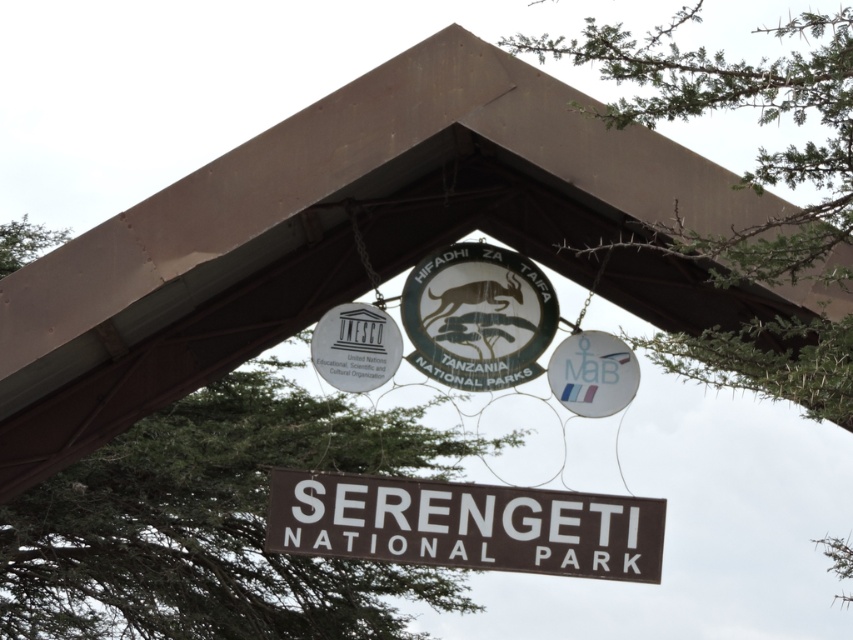
Is green leafy tree at center smaller than brown matte signboard at center?

Actually, green leafy tree at center might be larger than brown matte signboard at center.

Between green leafy tree at center and brown matte signboard at center, which one appears on the right side from the viewer's perspective?

brown matte signboard at center

Measure the distance between point (462, 593) and camera.

Point (462, 593) is 305.07 feet away from camera.

Locate an element on the screen. The width and height of the screenshot is (853, 640). green leafy tree at center is located at coordinates (216, 524).

Describe the element at coordinates (757, 120) in the screenshot. This screenshot has height=640, width=853. I see `green leafy tree at upper center` at that location.

Is point (791, 276) farther from viewer compared to point (471, 545)?

No, (791, 276) is closer to viewer.

This screenshot has height=640, width=853. Describe the element at coordinates (757, 120) in the screenshot. I see `green leafy tree at upper center` at that location.

Locate an element on the screen. The image size is (853, 640). green leafy tree at upper center is located at coordinates (757, 120).

Does point (734, 380) come closer to viewer compared to point (463, 266)?

Yes, point (734, 380) is in front of point (463, 266).

Locate an element on the screen. green leafy tree at upper center is located at coordinates (757, 120).

This screenshot has height=640, width=853. In order to click on green leafy tree at upper center in this screenshot , I will do pos(757,120).